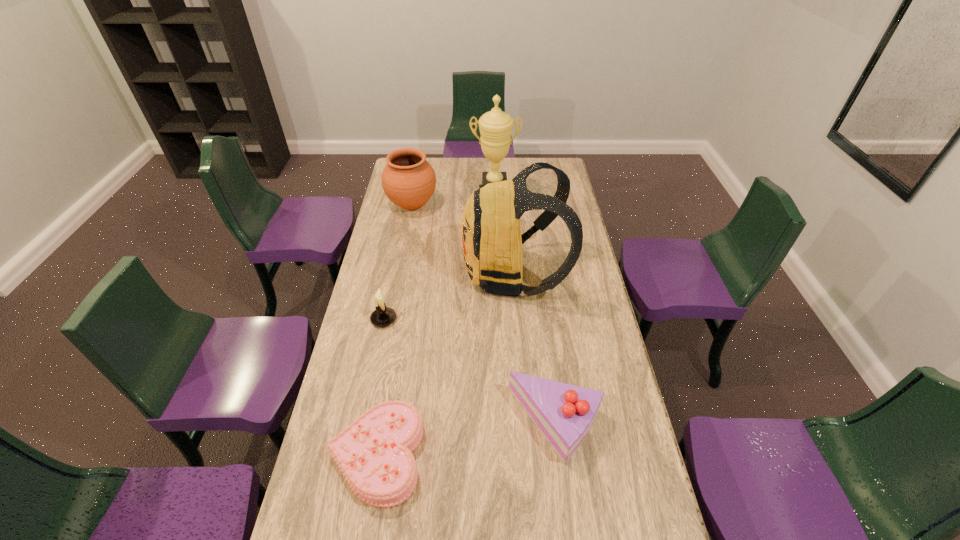
At what (x,y) coordinates should I click in order to perform the action: click on free point between the pottery and the shortest object. Please return your answer as a coordinate pair (x, y). Looking at the image, I should click on (394, 330).

Where is `free spot between the trophy cup and the third nearest object`? This screenshot has width=960, height=540. free spot between the trophy cup and the third nearest object is located at coordinates (439, 258).

Select which object is the fifth closest to the right cake. Please provide its 2D coordinates. Your answer should be formatted as a tuple, i.e. [(x, y)], where the tuple contains the x and y coordinates of a point satisfying the conditions above.

[(495, 126)]

Point out which object is positioned as the fourth nearest to the right cake. Please provide its 2D coordinates. Your answer should be formatted as a tuple, i.e. [(x, y)], where the tuple contains the x and y coordinates of a point satisfying the conditions above.

[(408, 180)]

You are a GUI agent. You are given a task and a screenshot of the screen. Output one action in this format:
    pyautogui.click(x=<x>, y=<y>)
    Task: Click on the free space that satisfies the following two spatial constraints: 1. on the front side of the pottery; 2. on the left side of the left cake
    
    Given the screenshot: What is the action you would take?
    pyautogui.click(x=364, y=455)

Locate an element on the screen. vacant space that satisfies the following two spatial constraints: 1. on the front side of the left cake; 2. on the right side of the candle holder is located at coordinates (355, 455).

Where is `vacant region that satisfies the following two spatial constraints: 1. on the front-facing side of the third farthest object; 2. on the front side of the candle holder`? The height and width of the screenshot is (540, 960). vacant region that satisfies the following two spatial constraints: 1. on the front-facing side of the third farthest object; 2. on the front side of the candle holder is located at coordinates [x=517, y=319].